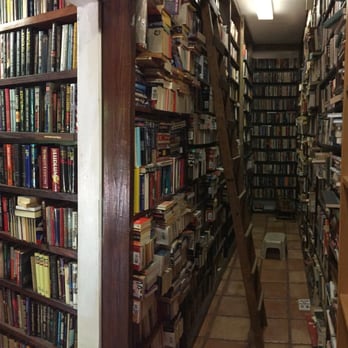
Find the location of a particular element. Image resolution: width=348 pixels, height=348 pixels. stool is located at coordinates (274, 242).